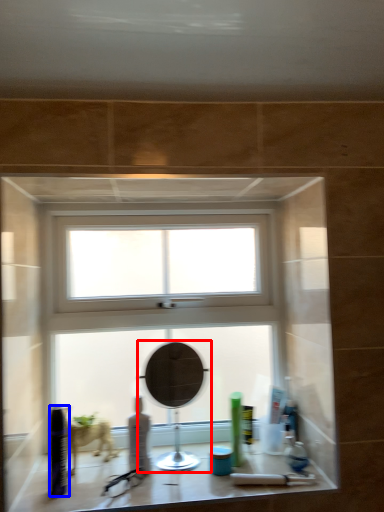
Question: Which of the following is the farthest to the observer, mirror (highlighted by a red box) or toiletry (highlighted by a blue box)?

Choices:
 (A) mirror
 (B) toiletry

Answer: (A)